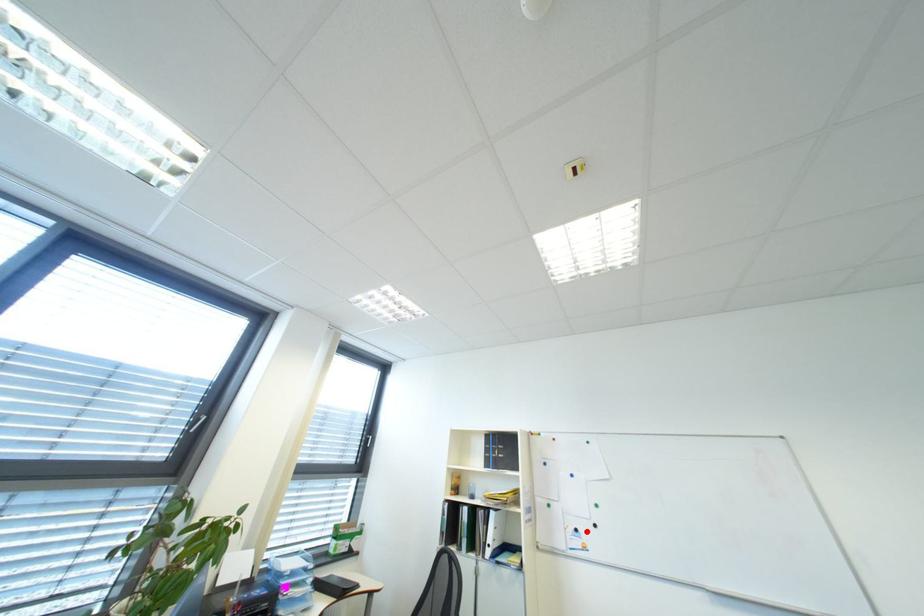
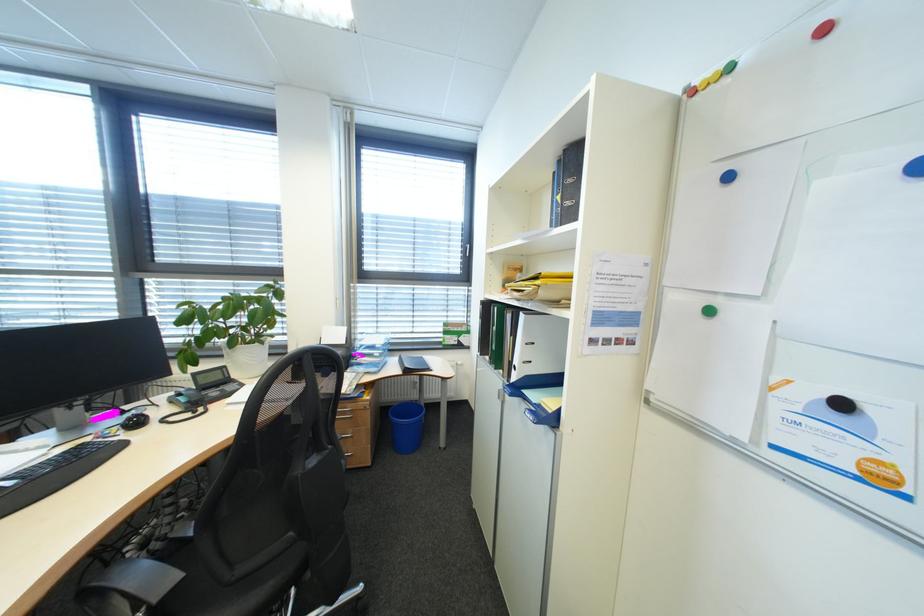
In the second image, find the point that corresponds to the highlighted location in the first image.

(854, 406)